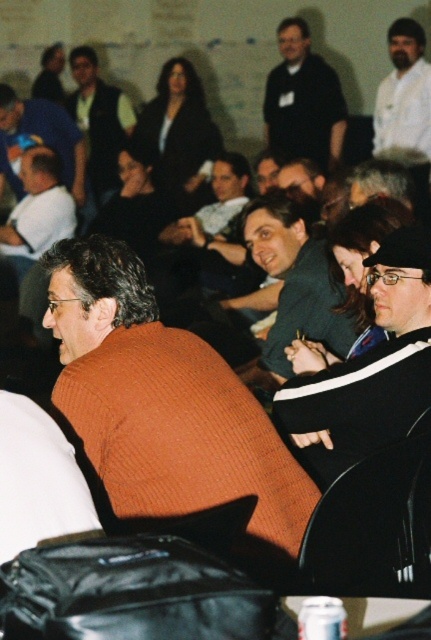
You are organizing a group photo and need to arrange two people based on their clothing sizes. The orange knitted sweater at center and the matte blue shirt at center are both in the frame. Which person should stand in the front row to ensure their clothing is fully visible?

The orange knitted sweater at center should stand in the front row because it is bigger than the matte blue shirt at center, allowing it to be more visible when positioned forward.

You are attending a professional event and notice two individuals in the front row. One is wearing an orange knitted sweater at center and the other is wearing a matte blue shirt at center. Which of these two is shorter in height?

The orange knitted sweater at center has a lesser height compared to matte blue shirt at center, so the person wearing the orange knitted sweater at center is shorter.